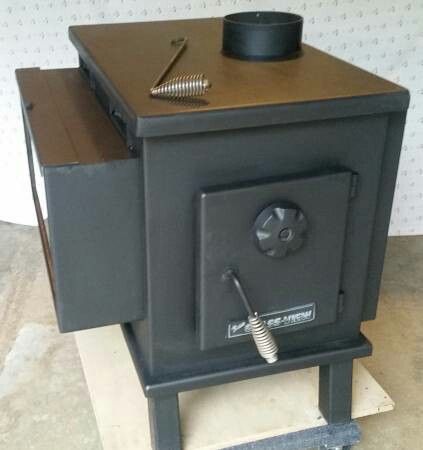
I want to click on wall, so click(351, 27).